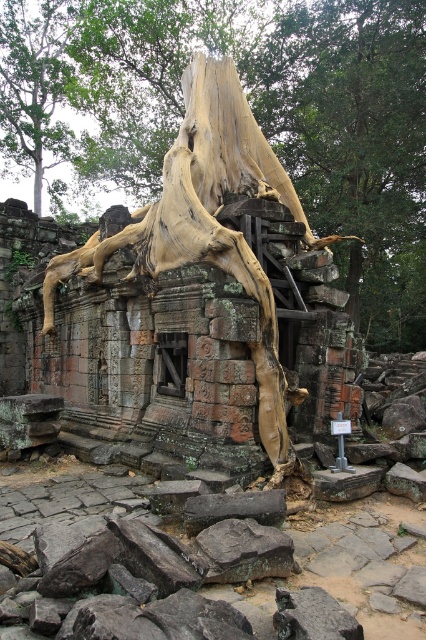
You are an archaeologist examining the ancient stone structure. You notice the light brown bark tree trunk at center and the smooth gray rock at center. Which object is positioned to the right side of the other?

The light brown bark tree trunk at center is to the left of the smooth gray rock at center, so the smooth gray rock at center is positioned to the right side of the light brown bark tree trunk at center.

Consider the image. You are standing at the base of the large tree trunk and want to reach the small window opening in the ancient stone structure. There are two points marked on your map as point 1 at coordinates (97,100) and point 2 at coordinates (213,560). Which point should you head towards to get closer to the window?

Point 2 at coordinates (213,560) is closer to the window because point 1 is behind point 2, meaning point 2 is in front and closer to the observer.

You are an archaeologist examining the ancient stone structure. You notice the light brown bark tree trunk at center and the smooth gray rock at center. Which object is closer to your viewpoint?

The light brown bark tree trunk at center is closer to your viewpoint as it is positioned further to the viewer than the smooth gray rock at center.